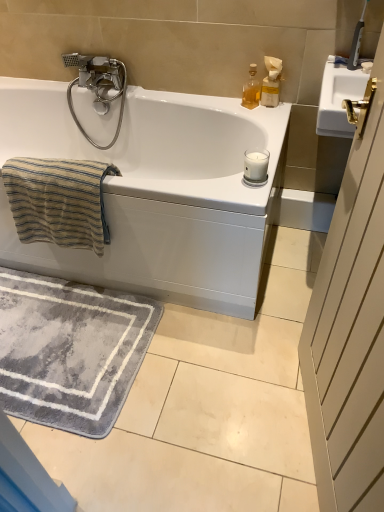
Question: Based on their positions, is beige striped towel at left located to the left or right of translucent glass bottle at upper right, arranged as the 1th soap dispenser when viewed from the left?

Choices:
 (A) left
 (B) right

Answer: (A)

Question: Is point (26, 200) positioned closer to the camera than point (249, 104)?

Choices:
 (A) closer
 (B) farther

Answer: (A)

Question: Which is farther from the translucent glass bottle at upper right, which appears as the 2th soap dispenser when viewed from the right?

Choices:
 (A) white wood screen door at right
 (B) silver metallic faucet at upper left
 (C) white plastic soap dispenser at upper right, the 1th soap dispenser positioned from the right
 (D) white glossy bathtub at upper center
 (E) beige striped towel at left

Answer: (A)

Question: Which object is the farthest from the silver metallic faucet at upper left?

Choices:
 (A) white glossy bathtub at upper center
 (B) white plastic soap dispenser at upper right, the 1th soap dispenser positioned from the right
 (C) white wood screen door at right
 (D) translucent glass bottle at upper right, which appears as the 2th soap dispenser when viewed from the right
 (E) gray plush bath mat at lower left

Answer: (C)